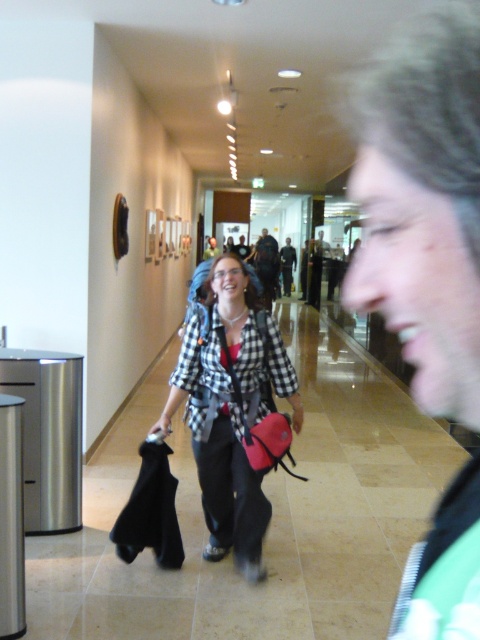
You are standing in the hallway and see the matte red bag at center. Can you estimate its exact coordinates based on the scene?

The matte red bag at center is located at point (262, 428).

You are trying to decide whether to place the green fabric jacket at right and the matte red bag at center on a shelf that can only hold items narrower than 30 cm. Which item is more likely to fit?

The green fabric jacket at right is more likely to fit on the shelf since its width is less than that of the matte red bag at center, which may exceed the 30 cm limit.